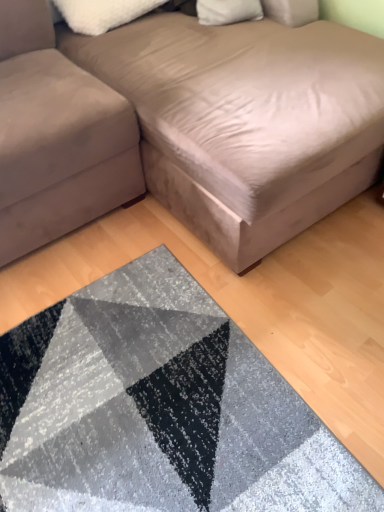
Describe the element at coordinates (187, 126) in the screenshot. I see `suede-like beige studio couch at upper center, marked as the first studio couch in a right-to-left arrangement` at that location.

In order to face white fluffy pillow at upper center, should I rotate leftwards or rightwards?

You should rotate left by 7.611 degrees.

This screenshot has width=384, height=512. What do you see at coordinates (56, 137) in the screenshot?
I see `suede-like beige couch at lower left, marked as the 2th studio couch in a right-to-left arrangement` at bounding box center [56, 137].

The image size is (384, 512). Identify the location of suede-like beige studio couch at upper center, marked as the first studio couch in a right-to-left arrangement. (187, 126).

Which object is more forward, white fluffy pillow at upper center or suede-like beige couch at lower left, which is the 1th studio couch in left-to-right order?

suede-like beige couch at lower left, which is the 1th studio couch in left-to-right order, is in front.

Which is behind, point (101, 24) or point (77, 194)?

Point (101, 24)

Would you say white fluffy pillow at upper center is to the left or to the right of suede-like beige couch at lower left, marked as the 2th studio couch in a right-to-left arrangement, in the picture?

Clearly, white fluffy pillow at upper center is on the right of suede-like beige couch at lower left, marked as the 2th studio couch in a right-to-left arrangement, in the image.

Is suede-like beige studio couch at upper center, marked as the first studio couch in a right-to-left arrangement, inside or outside of white fluffy pillow at upper center?

suede-like beige studio couch at upper center, marked as the first studio couch in a right-to-left arrangement, cannot be found inside white fluffy pillow at upper center.

Are suede-like beige studio couch at upper center, acting as the second studio couch starting from the left, and white fluffy pillow at upper center beside each other?

No.

Locate an element on the screen. This screenshot has height=512, width=384. studio couch that is the 1st one when counting downward from the white fluffy pillow at upper center (from the image's perspective) is located at coordinates (187, 126).

Would you say suede-like beige couch at lower left, which is the 1th studio couch in left-to-right order, is outside textured gray rug at lower center?

Yes, suede-like beige couch at lower left, which is the 1th studio couch in left-to-right order, is outside of textured gray rug at lower center.

Looking at their sizes, would you say suede-like beige couch at lower left, which is the 1th studio couch in left-to-right order, is wider or thinner than textured gray rug at lower center?

suede-like beige couch at lower left, which is the 1th studio couch in left-to-right order, is wider than textured gray rug at lower center.

From a real-world perspective, is suede-like beige couch at lower left, marked as the 2th studio couch in a right-to-left arrangement, located beneath textured gray rug at lower center?

No, from a real-world perspective, suede-like beige couch at lower left, marked as the 2th studio couch in a right-to-left arrangement, is not beneath textured gray rug at lower center.

Could you measure the distance between suede-like beige studio couch at upper center, acting as the second studio couch starting from the left, and suede-like beige couch at lower left, marked as the 2th studio couch in a right-to-left arrangement?

suede-like beige studio couch at upper center, acting as the second studio couch starting from the left, and suede-like beige couch at lower left, marked as the 2th studio couch in a right-to-left arrangement, are 7.62 inches apart from each other.

Is suede-like beige studio couch at upper center, marked as the first studio couch in a right-to-left arrangement, next to suede-like beige couch at lower left, marked as the 2th studio couch in a right-to-left arrangement?

No, suede-like beige studio couch at upper center, marked as the first studio couch in a right-to-left arrangement, is not touching suede-like beige couch at lower left, marked as the 2th studio couch in a right-to-left arrangement.

From the image's perspective, which one is positioned lower, suede-like beige studio couch at upper center, marked as the first studio couch in a right-to-left arrangement, or suede-like beige couch at lower left, which is the 1th studio couch in left-to-right order?

suede-like beige couch at lower left, which is the 1th studio couch in left-to-right order.

Can you confirm if white fluffy pillow at upper center is wider than suede-like beige studio couch at upper center, acting as the second studio couch starting from the left?

In fact, white fluffy pillow at upper center might be narrower than suede-like beige studio couch at upper center, acting as the second studio couch starting from the left.

How different are the orientations of white fluffy pillow at upper center and suede-like beige studio couch at upper center, acting as the second studio couch starting from the left, in degrees?

4.83 degrees.

Where is `studio couch on the right side of white fluffy pillow at upper center`? studio couch on the right side of white fluffy pillow at upper center is located at coordinates (187, 126).

Is white fluffy pillow at upper center to the left of suede-like beige studio couch at upper center, acting as the second studio couch starting from the left, from the viewer's perspective?

Correct, you'll find white fluffy pillow at upper center to the left of suede-like beige studio couch at upper center, acting as the second studio couch starting from the left.

Considering the sizes of suede-like beige studio couch at upper center, acting as the second studio couch starting from the left, and textured gray rug at lower center in the image, is suede-like beige studio couch at upper center, acting as the second studio couch starting from the left, wider or thinner than textured gray rug at lower center?

In the image, suede-like beige studio couch at upper center, acting as the second studio couch starting from the left, appears to be wider than textured gray rug at lower center.

Locate an element on the screen. This screenshot has width=384, height=512. the 2nd studio couch above the textured gray rug at lower center (from the image's perspective) is located at coordinates (187, 126).

Considering the positions of objects suede-like beige studio couch at upper center, acting as the second studio couch starting from the left, and textured gray rug at lower center in the image provided, who is in front, suede-like beige studio couch at upper center, acting as the second studio couch starting from the left, or textured gray rug at lower center?

suede-like beige studio couch at upper center, acting as the second studio couch starting from the left, is closer to the camera.

Is suede-like beige studio couch at upper center, marked as the first studio couch in a right-to-left arrangement, positioned with its back to textured gray rug at lower center?

No, suede-like beige studio couch at upper center, marked as the first studio couch in a right-to-left arrangement, is not facing away from textured gray rug at lower center.

Is white fluffy pillow at upper center a part of textured gray rug at lower center?

No.

Between point (246, 382) and point (105, 17), which one is positioned in front?

Positioned in front is point (246, 382).

Is the position of textured gray rug at lower center less distant than that of white fluffy pillow at upper center?

Yes, textured gray rug at lower center is closer to the camera.

The width and height of the screenshot is (384, 512). What are the coordinates of `pillow located above the suede-like beige couch at lower left, which is the 1th studio couch in left-to-right order (from a real-world perspective)` in the screenshot? It's located at (102, 13).

Find the location of a particular element. the 2nd studio couch in front when counting from the white fluffy pillow at upper center is located at coordinates (187, 126).

When comparing their distances from suede-like beige couch at lower left, which is the 1th studio couch in left-to-right order, does white fluffy pillow at upper center or textured gray rug at lower center seem further?

textured gray rug at lower center is positioned further to the anchor suede-like beige couch at lower left, which is the 1th studio couch in left-to-right order.

Based on their spatial positions, is textured gray rug at lower center or suede-like beige studio couch at upper center, acting as the second studio couch starting from the left, further from white fluffy pillow at upper center?

textured gray rug at lower center lies further to white fluffy pillow at upper center than the other object.

Considering their positions, is suede-like beige couch at lower left, which is the 1th studio couch in left-to-right order, positioned closer to suede-like beige studio couch at upper center, marked as the first studio couch in a right-to-left arrangement, than textured gray rug at lower center?

Among the two, suede-like beige couch at lower left, which is the 1th studio couch in left-to-right order, is located nearer to suede-like beige studio couch at upper center, marked as the first studio couch in a right-to-left arrangement.

When comparing their distances from suede-like beige couch at lower left, which is the 1th studio couch in left-to-right order, does suede-like beige studio couch at upper center, acting as the second studio couch starting from the left, or textured gray rug at lower center seem closer?

Based on the image, suede-like beige studio couch at upper center, acting as the second studio couch starting from the left, appears to be nearer to suede-like beige couch at lower left, which is the 1th studio couch in left-to-right order.

Estimate the real-world distances between objects in this image. Which object is closer to white fluffy pillow at upper center, suede-like beige couch at lower left, which is the 1th studio couch in left-to-right order, or textured gray rug at lower center?

suede-like beige couch at lower left, which is the 1th studio couch in left-to-right order, is positioned closer to the anchor white fluffy pillow at upper center.

From the image, which object appears to be farther from suede-like beige studio couch at upper center, acting as the second studio couch starting from the left, textured gray rug at lower center or white fluffy pillow at upper center?

Among the two, textured gray rug at lower center is located further to suede-like beige studio couch at upper center, acting as the second studio couch starting from the left.

Considering their positions, is white fluffy pillow at upper center positioned further to suede-like beige studio couch at upper center, acting as the second studio couch starting from the left, than suede-like beige couch at lower left, which is the 1th studio couch in left-to-right order?

white fluffy pillow at upper center is further to suede-like beige studio couch at upper center, acting as the second studio couch starting from the left.

Considering their positions, is suede-like beige studio couch at upper center, acting as the second studio couch starting from the left, positioned closer to suede-like beige couch at lower left, which is the 1th studio couch in left-to-right order, than white fluffy pillow at upper center?

Among the two, suede-like beige studio couch at upper center, acting as the second studio couch starting from the left, is located nearer to suede-like beige couch at lower left, which is the 1th studio couch in left-to-right order.

The width and height of the screenshot is (384, 512). Find the location of `studio couch between suede-like beige studio couch at upper center, marked as the first studio couch in a right-to-left arrangement, and textured gray rug at lower center from top to bottom`. studio couch between suede-like beige studio couch at upper center, marked as the first studio couch in a right-to-left arrangement, and textured gray rug at lower center from top to bottom is located at coordinates (56, 137).

Locate an element on the screen. Image resolution: width=384 pixels, height=512 pixels. studio couch between suede-like beige studio couch at upper center, marked as the first studio couch in a right-to-left arrangement, and white fluffy pillow at upper center in the front-back direction is located at coordinates (56, 137).